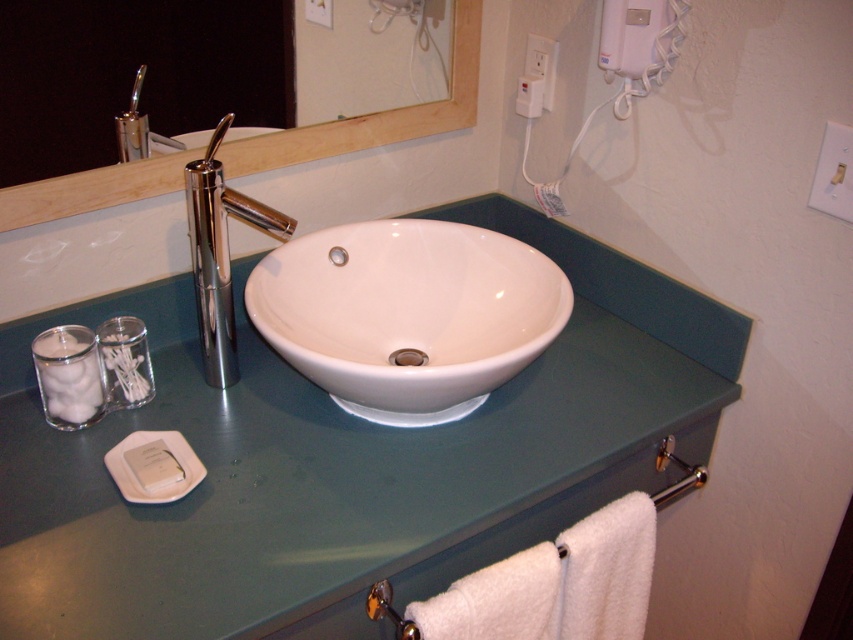
Question: Does green matte countertop at center lie in front of white matte soap at lower left?

Choices:
 (A) yes
 (B) no

Answer: (A)

Question: Based on their relative distances, which object is nearer to the white glossy sink at center?

Choices:
 (A) wooden-framed mirror at upper center
 (B) white matte soap at lower left

Answer: (A)

Question: Which of the following is the farthest from the observer?

Choices:
 (A) (250, 211)
 (B) (398, 262)

Answer: (B)

Question: From the image, what is the correct spatial relationship of green matte countertop at center in relation to white glossy sink at center?

Choices:
 (A) left
 (B) right

Answer: (A)

Question: Which is farther from the white glossy sink at center?

Choices:
 (A) wooden-framed mirror at upper center
 (B) polished chrome faucet at upper left

Answer: (B)

Question: Is polished chrome faucet at center closer to the viewer compared to white matte soap at lower left?

Choices:
 (A) yes
 (B) no

Answer: (B)